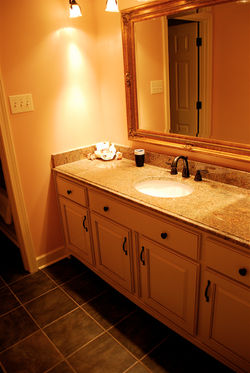
The image size is (250, 373). In order to click on countertop in this screenshot , I will do `click(207, 206)`.